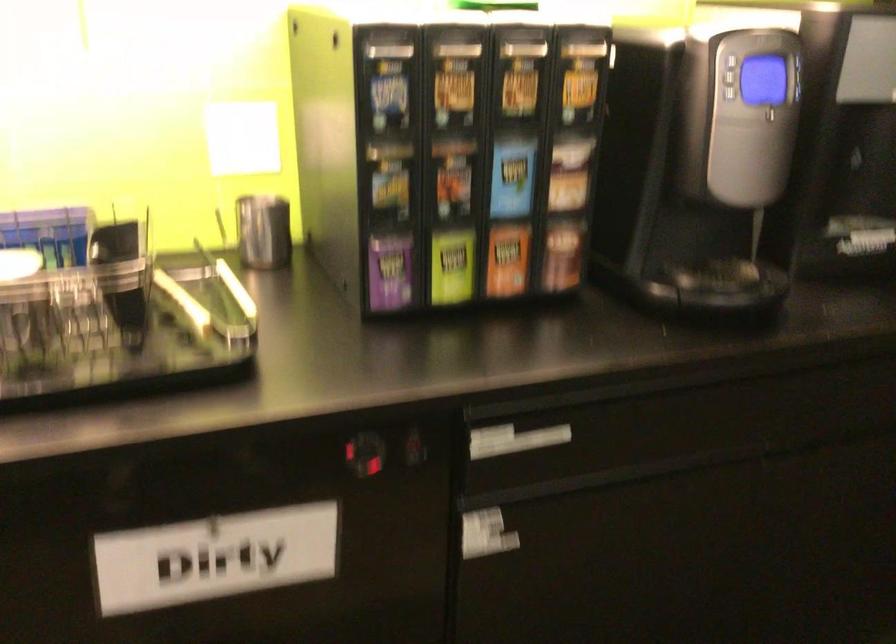
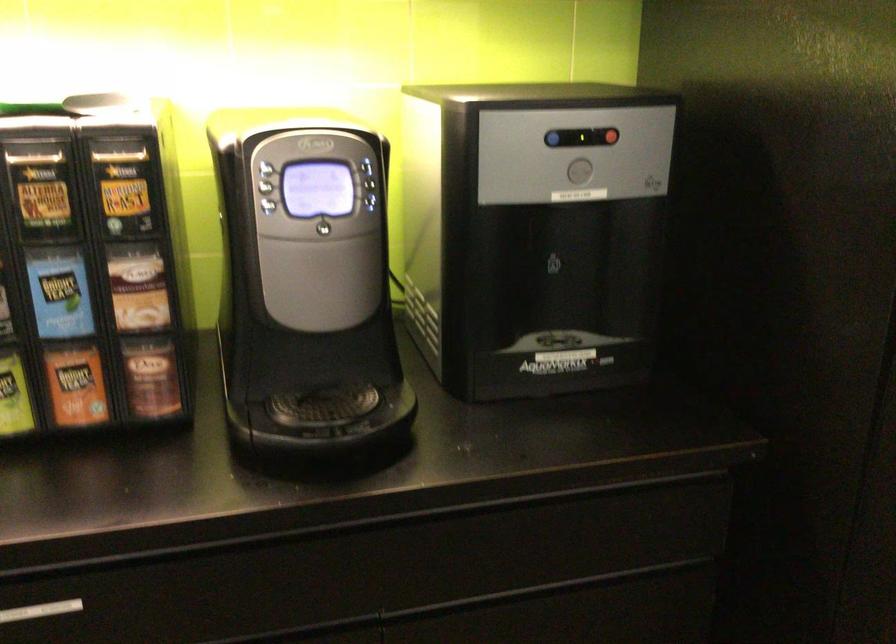
The point at (728,93) is marked in the first image. Where is the corresponding point in the second image?

(268, 205)